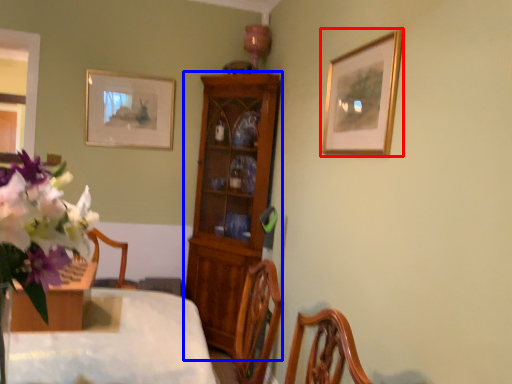
Question: Which object appears closest to the camera in this image, picture frame (highlighted by a red box) or cabinetry (highlighted by a blue box)?

Choices:
 (A) picture frame
 (B) cabinetry

Answer: (A)